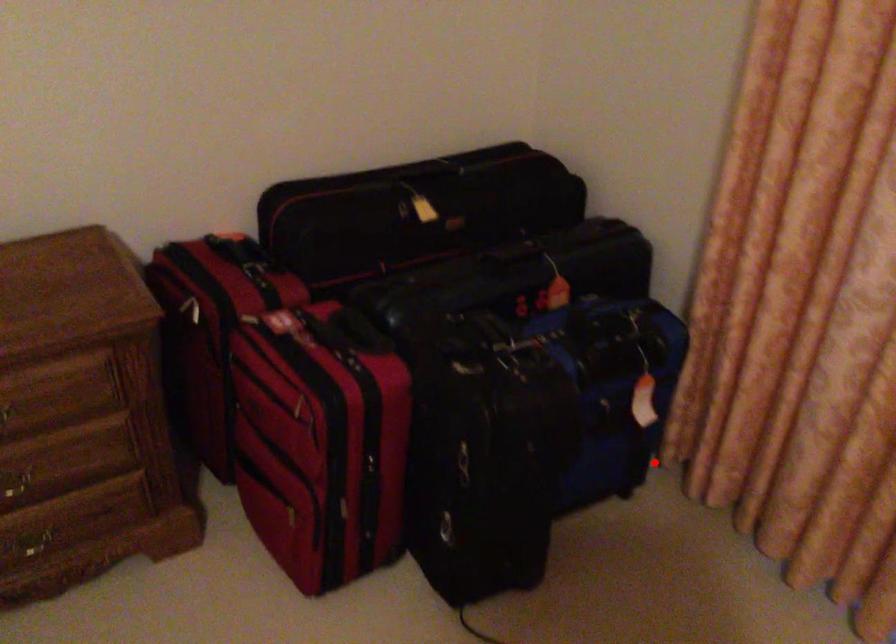
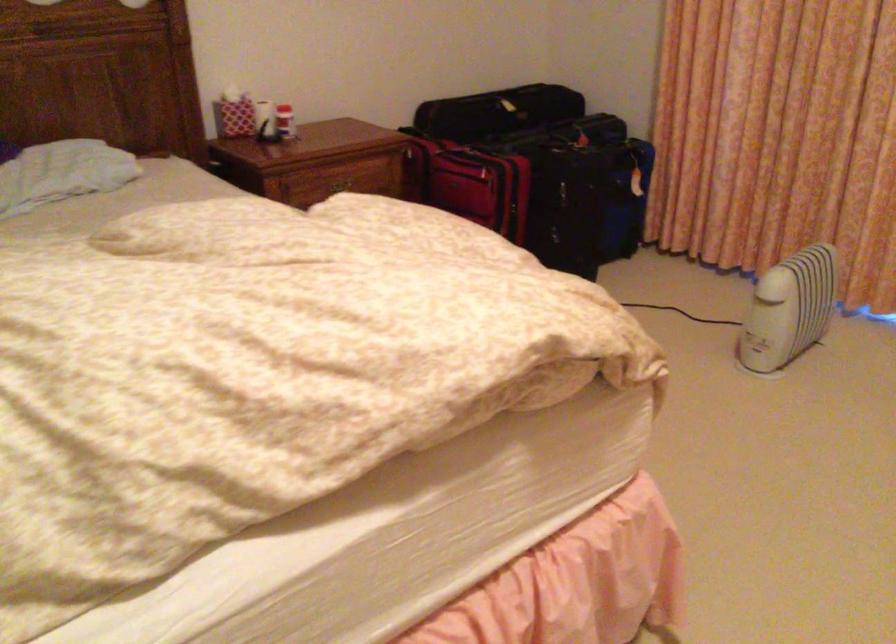
Question: A red point is marked in image1. In image2, is the corresponding 3D point closer to the camera or farther? Reply with the corresponding letter.

Choices:
 (A) The corresponding 3D point is closer.
 (B) The corresponding 3D point is farther.

Answer: (B)